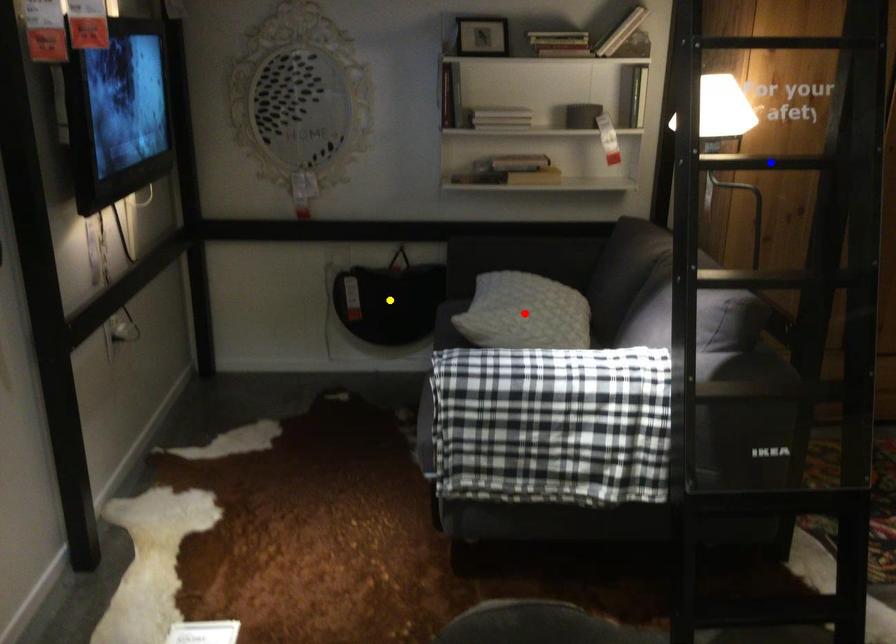
Order these from farthest to nearest:
A) red point
B) blue point
C) yellow point

yellow point → red point → blue point